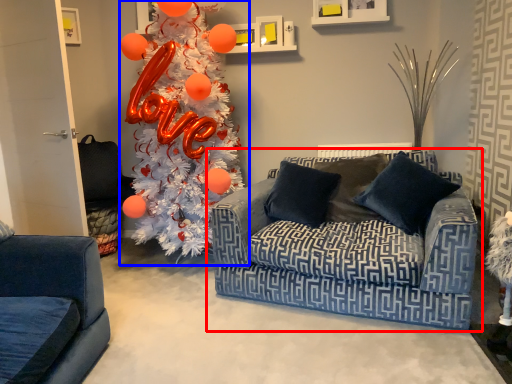
Question: Which object appears farthest to the camera in this image, studio couch (highlighted by a red box) or christmas tree (highlighted by a blue box)?

Choices:
 (A) studio couch
 (B) christmas tree

Answer: (B)